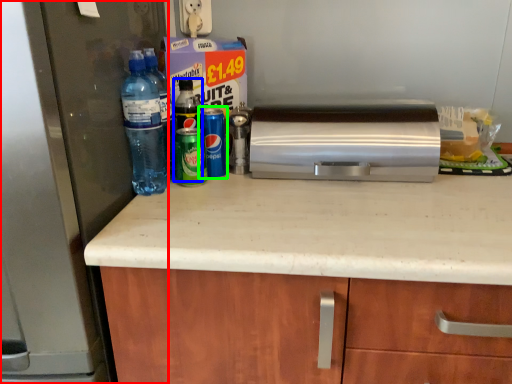
Question: Estimate the real-world distances between objects in this image. Which object is farther from refrigerator (highlighted by a red box), bottle (highlighted by a blue box) or bottle (highlighted by a green box)?

Choices:
 (A) bottle
 (B) bottle

Answer: (A)